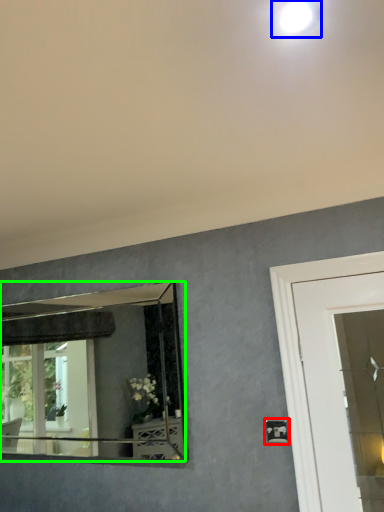
Question: Which object is positioned farthest from light switch (highlighted by a red box)? Select from droplight (highlighted by a blue box) and mirror (highlighted by a green box).

Choices:
 (A) droplight
 (B) mirror

Answer: (B)